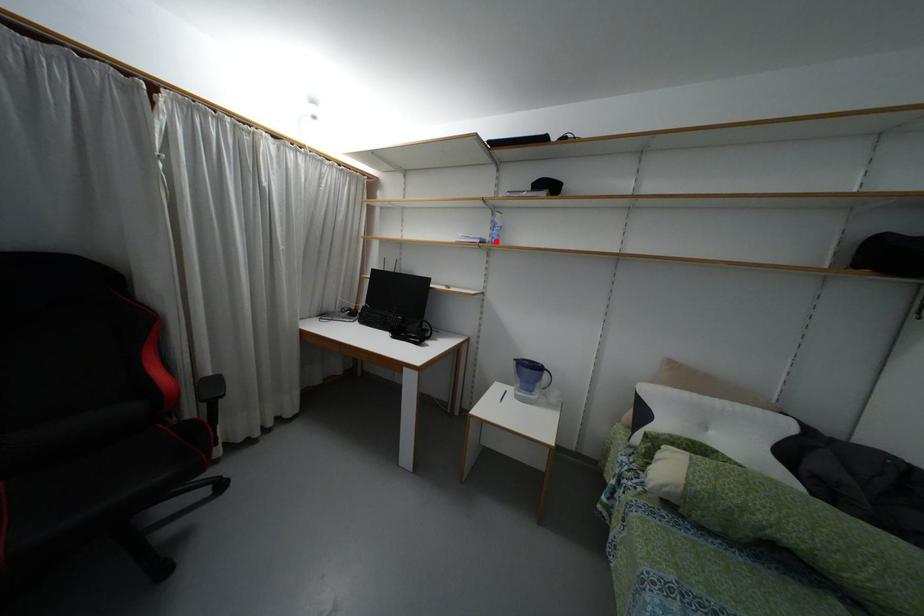
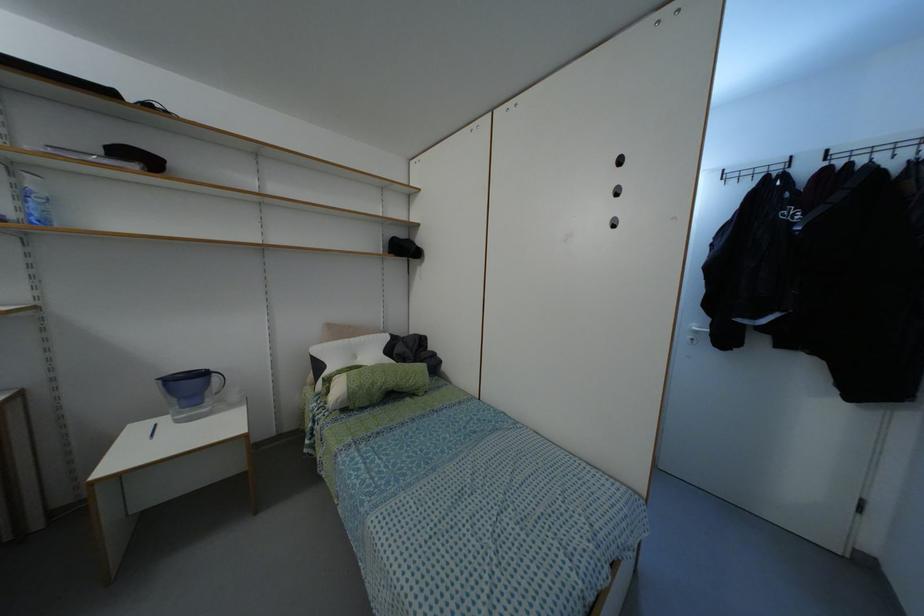
Where in the second image is the point corresponding to the highlighted location from the first image?

(44, 222)